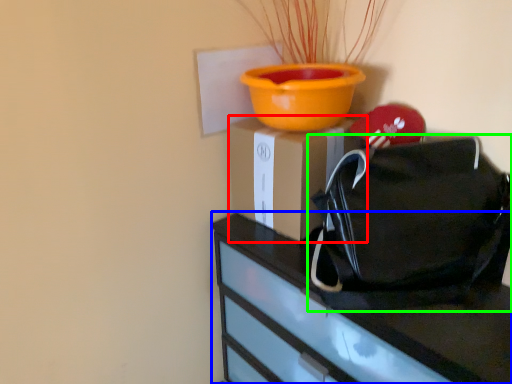
Question: Which is farther away from cardboard box (highlighted by a red box)? furniture (highlighted by a blue box) or handbag (highlighted by a green box)?

Choices:
 (A) furniture
 (B) handbag

Answer: (A)